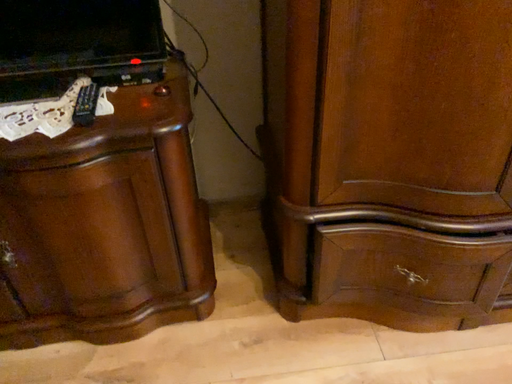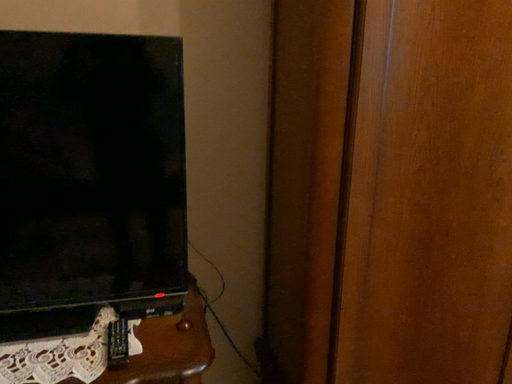
Question: How did the camera likely rotate when shooting the video?

Choices:
 (A) rotated right
 (B) rotated left

Answer: (A)